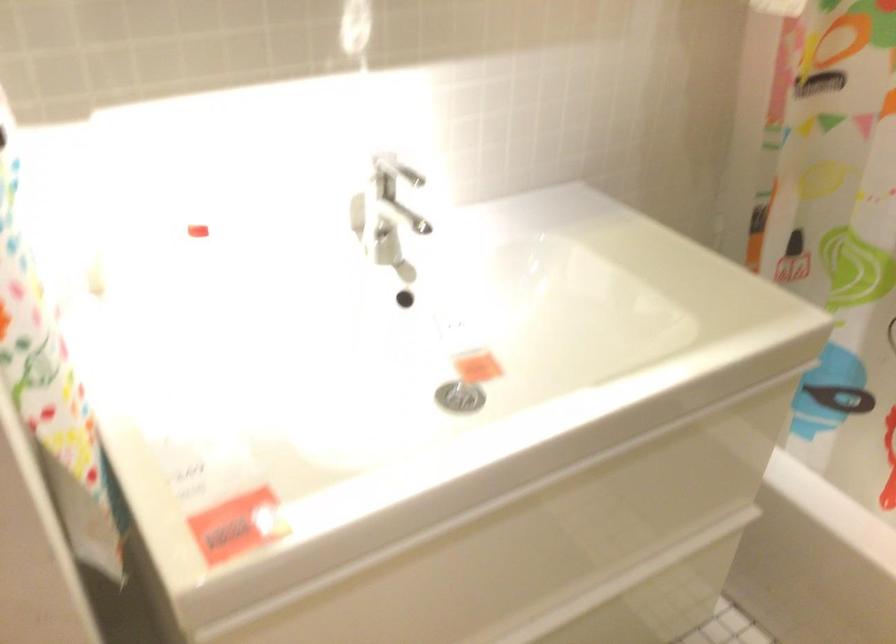
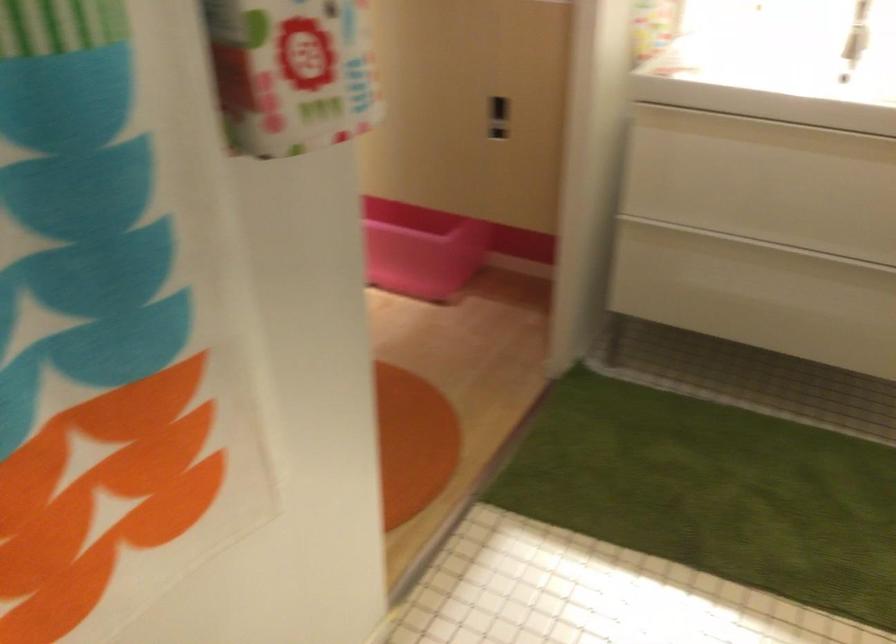
Find the pixel in the second image that matches point (462, 535) in the first image.

(764, 131)